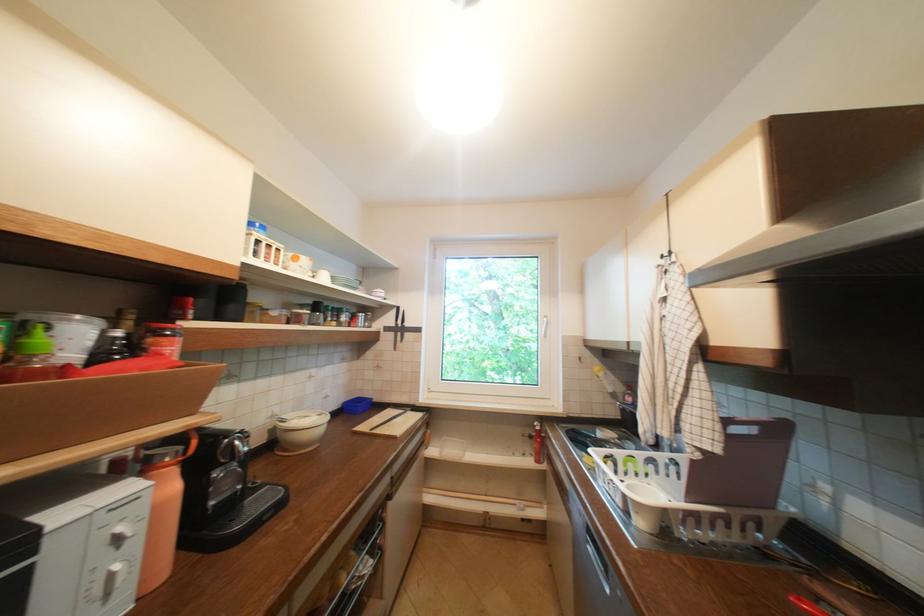
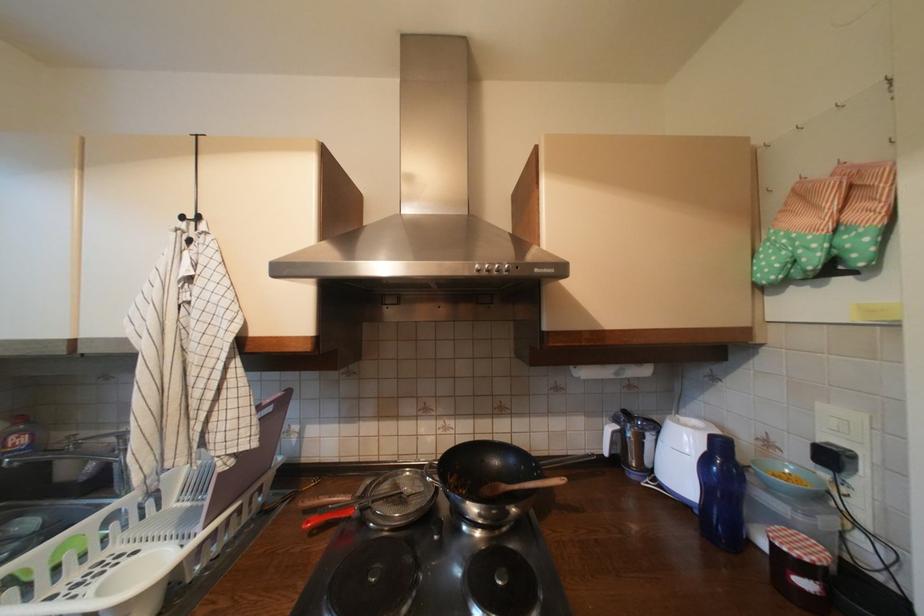
Question: The images are taken continuously from a first-person perspective. In which direction is your viewpoint rotating?

Choices:
 (A) Left
 (B) Right
 (C) Up
 (D) Down

Answer: (B)